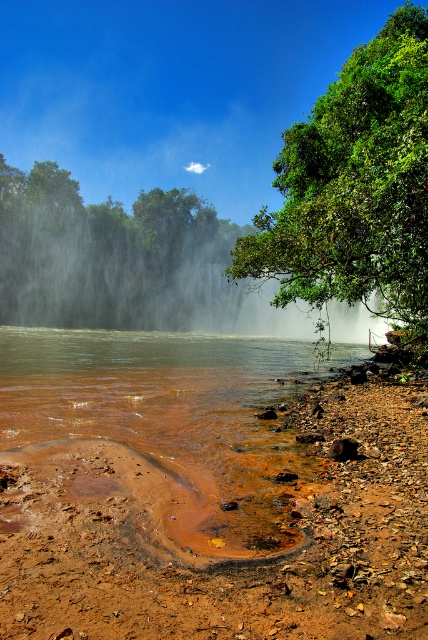
Question: Among these objects, which one is nearest to the camera?

Choices:
 (A) white mist at center
 (B) green leafy tree at upper right

Answer: (B)

Question: Which of the following is the closest to the observer?

Choices:
 (A) brown muddy water at lower left
 (B) green leafy tree at upper right

Answer: (A)

Question: Does white mist at center appear on the left side of brown muddy water at lower left?

Choices:
 (A) no
 (B) yes

Answer: (B)

Question: Estimate the real-world distances between objects in this image. Which object is farther from the white mist at center?

Choices:
 (A) green leafy tree at upper right
 (B) brown muddy water at lower left

Answer: (A)

Question: Is brown muddy water at lower left wider than green leafy tree at upper right?

Choices:
 (A) no
 (B) yes

Answer: (B)

Question: Where is brown muddy water at lower left located in relation to green leafy tree at upper right in the image?

Choices:
 (A) above
 (B) below

Answer: (B)